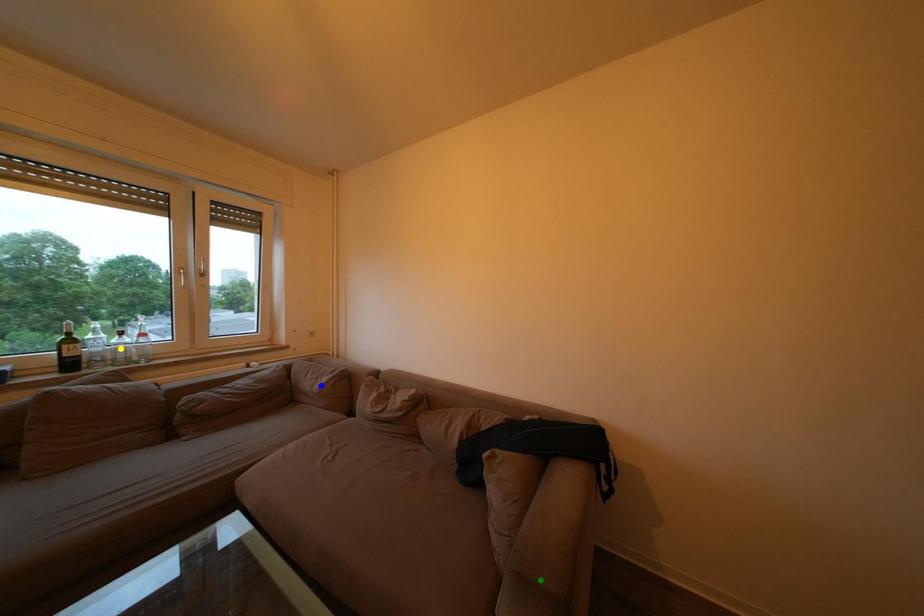
Order these from nearest to farthest:
- blue point
- yellow point
- green point

green point, yellow point, blue point